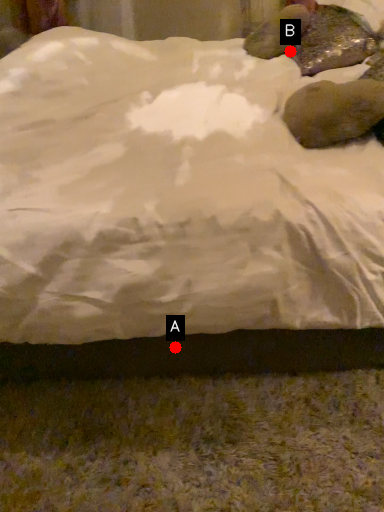
Question: Two points are circled on the image, labeled by A and B beside each circle. Which point is farther from the camera taking this photo?

Choices:
 (A) A is further
 (B) B is further

Answer: (B)